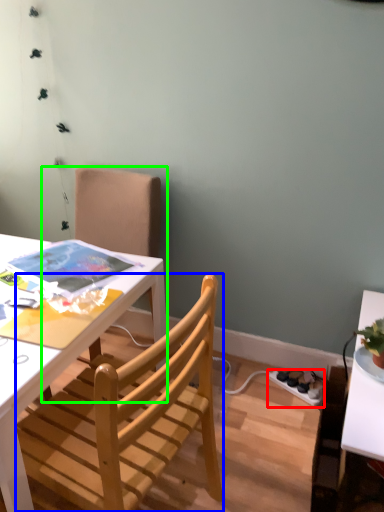
Question: Based on their relative distances, which object is nearer to power outlet (highlighted by a red box)? Choose from chair (highlighted by a blue box) and chair (highlighted by a green box).

Choices:
 (A) chair
 (B) chair

Answer: (A)